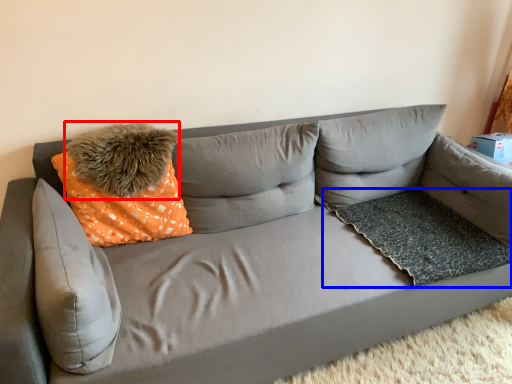
Question: Which object is further to the camera taking this photo, pillow (highlighted by a red box) or dog bed (highlighted by a blue box)?

Choices:
 (A) pillow
 (B) dog bed

Answer: (B)